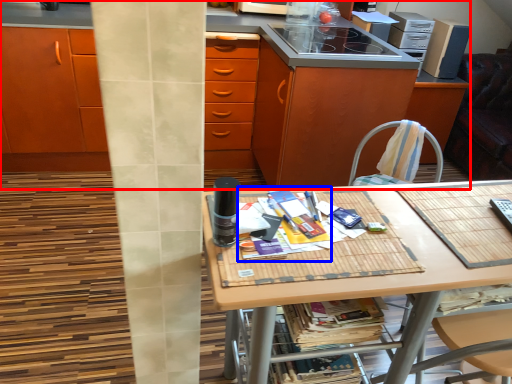
Question: Among these objects, which one is nearest to the camera, cabinetry (highlighted by a red box) or magazine (highlighted by a blue box)?

Choices:
 (A) cabinetry
 (B) magazine

Answer: (B)